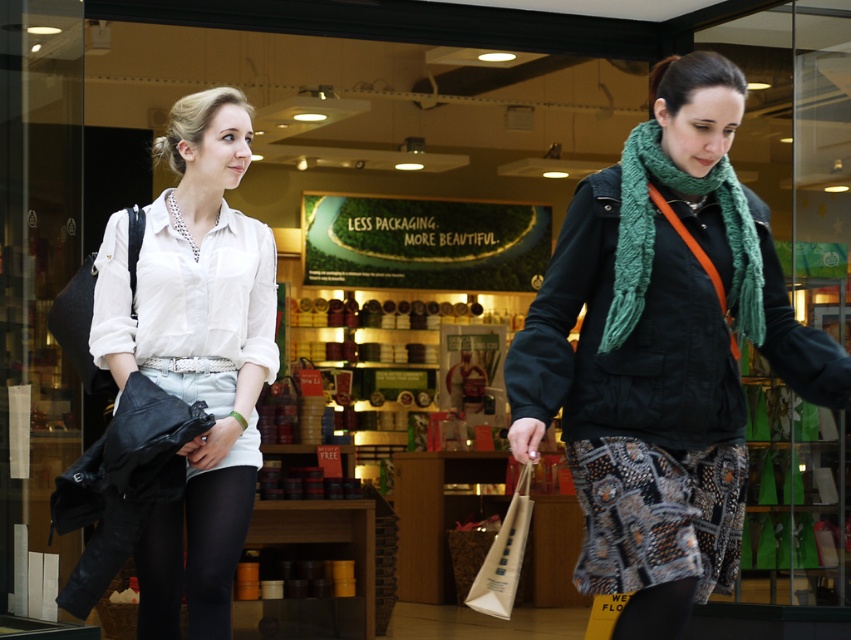
Question: Which point is farther to the camera?

Choices:
 (A) (497, 604)
 (B) (220, 630)
 (C) (601, 342)
 (D) (700, 339)

Answer: (B)

Question: Estimate the real-world distances between objects in this image. Which object is closer to the knitted green scarf at center?

Choices:
 (A) white matte shirt at center
 (B) green knitted scarf at center
 (C) black tights at lower left

Answer: (B)

Question: Does green knitted scarf at center have a smaller size compared to white paper bag at lower center?

Choices:
 (A) yes
 (B) no

Answer: (A)

Question: Is white matte shirt at center above white paper bag at lower center?

Choices:
 (A) no
 (B) yes

Answer: (B)

Question: Which object is the closest to the white paper bag at lower center?

Choices:
 (A) knitted green scarf at center
 (B) black tights at lower left

Answer: (A)

Question: Can you confirm if knitted green scarf at center is smaller than green knitted scarf at center?

Choices:
 (A) yes
 (B) no

Answer: (B)